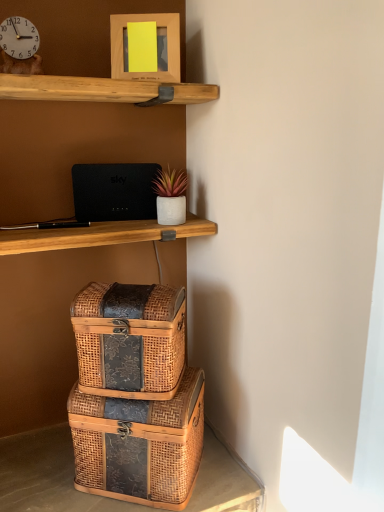
Question: Should I look upward or downward to see black matte router at upper center?

Choices:
 (A) down
 (B) up

Answer: (B)

Question: Can you confirm if black matte router at upper center is wider than white glossy clock at upper left?

Choices:
 (A) no
 (B) yes

Answer: (A)

Question: Considering the relative sizes of black matte router at upper center and white glossy clock at upper left in the image provided, is black matte router at upper center thinner than white glossy clock at upper left?

Choices:
 (A) yes
 (B) no

Answer: (A)

Question: Is black matte router at upper center turned away from white glossy clock at upper left?

Choices:
 (A) yes
 (B) no

Answer: (B)

Question: Is black matte router at upper center smaller than white glossy clock at upper left?

Choices:
 (A) yes
 (B) no

Answer: (B)

Question: From the image's perspective, is black matte router at upper center beneath white glossy clock at upper left?

Choices:
 (A) no
 (B) yes

Answer: (B)

Question: Is black matte router at upper center positioned in front of white glossy clock at upper left?

Choices:
 (A) no
 (B) yes

Answer: (A)

Question: Is the depth of white glossy clock at upper left greater than that of wooden picture frame at upper center?

Choices:
 (A) no
 (B) yes

Answer: (A)

Question: From the image's perspective, is white glossy clock at upper left under wooden picture frame at upper center?

Choices:
 (A) no
 (B) yes

Answer: (B)

Question: From the image's perspective, is white glossy clock at upper left on top of wooden picture frame at upper center?

Choices:
 (A) yes
 (B) no

Answer: (B)

Question: Considering the relative sizes of white glossy clock at upper left and wooden picture frame at upper center in the image provided, is white glossy clock at upper left wider than wooden picture frame at upper center?

Choices:
 (A) no
 (B) yes

Answer: (B)

Question: Can we say white glossy clock at upper left lies outside wooden picture frame at upper center?

Choices:
 (A) yes
 (B) no

Answer: (A)

Question: Considering the relative sizes of white glossy clock at upper left and wooden picture frame at upper center in the image provided, is white glossy clock at upper left taller than wooden picture frame at upper center?

Choices:
 (A) yes
 (B) no

Answer: (B)

Question: Considering the relative sizes of woven wood trunk at lower center and woven wood box at lower center, positioned as the 1th box in top-to-bottom order, in the image provided, is woven wood trunk at lower center bigger than woven wood box at lower center, positioned as the 1th box in top-to-bottom order,?

Choices:
 (A) yes
 (B) no

Answer: (B)